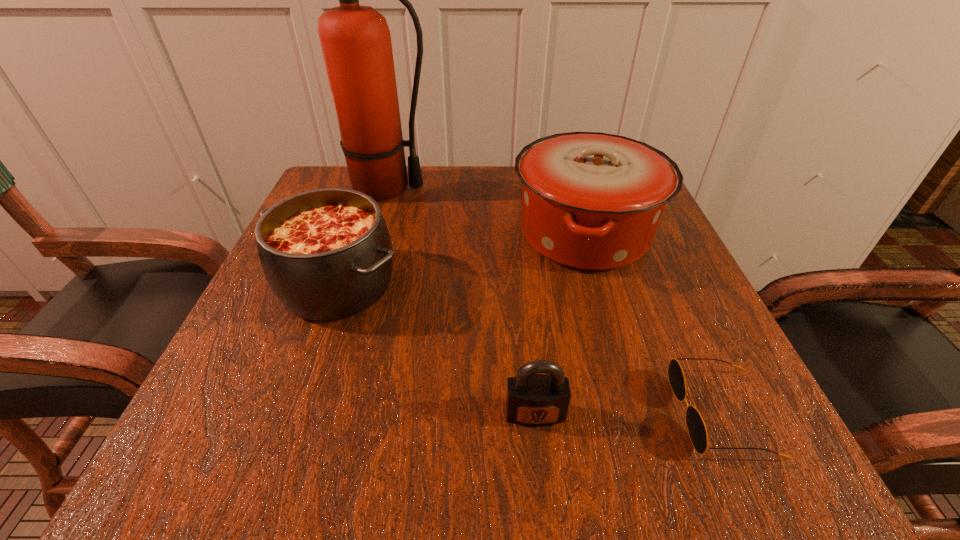
The image size is (960, 540). I want to click on fire extinguisher, so 356,43.

Locate an element on the screen. the right casserole is located at coordinates (592, 201).

At what (x,y) coordinates should I click in order to perform the action: click on the taller casserole. Please return your answer as a coordinate pair (x, y). Image resolution: width=960 pixels, height=540 pixels. Looking at the image, I should click on (592, 201).

Identify the location of the shorter casserole. This screenshot has height=540, width=960. (326, 254).

This screenshot has height=540, width=960. What are the coordinates of `the left casserole` in the screenshot? It's located at (326, 254).

Identify the location of padlock. The height and width of the screenshot is (540, 960). (532, 399).

Locate an element on the screen. the shortest object is located at coordinates (696, 427).

In order to click on vacant area situated 0.130m on the nozzle of the fire extinguisher in this screenshot , I will do `click(490, 188)`.

Locate an element on the screen. This screenshot has height=540, width=960. vacant space located on the front of the fourth shortest object is located at coordinates (627, 378).

This screenshot has width=960, height=540. I want to click on vacant space located on the front of the left casserole, so click(x=278, y=455).